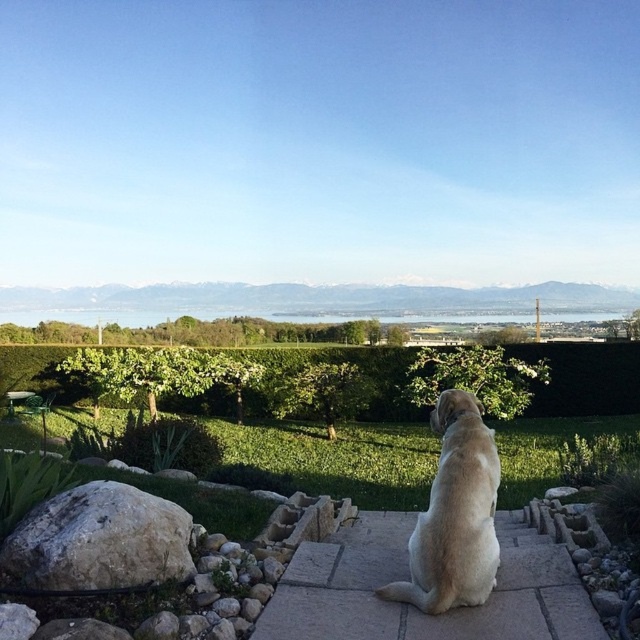
You are a photographer standing at the bottom left of the scene. You want to take a photo of both the green leafy hedge at center and the light brown fur at center. Which object should you move closer to first to ensure both are in focus?

You should move closer to the green leafy hedge at center first because the light brown fur at center is behind it. By focusing on the closer object, you can ensure both are in focus by adjusting the depth of field.

You are standing at the point marked by the coordinates point (x=99, y=540) which is the white rough rock at lower left. You want to walk towards the dog sitting on the stone pathway at bottom right. Which direction should you go?

The white rough rock at lower left is located at point (x=99, y=540). To reach the dog sitting on the stone pathway at bottom right, you should move towards the bottom right direction from your current position at the white rough rock at lower left.